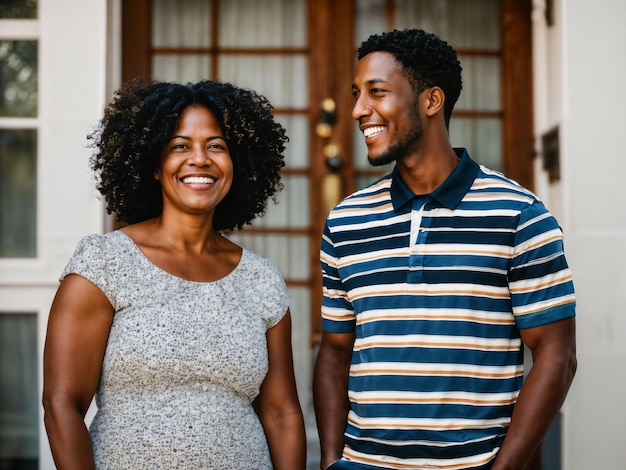
The width and height of the screenshot is (626, 470). I want to click on white walls, so click(593, 109), click(64, 123).